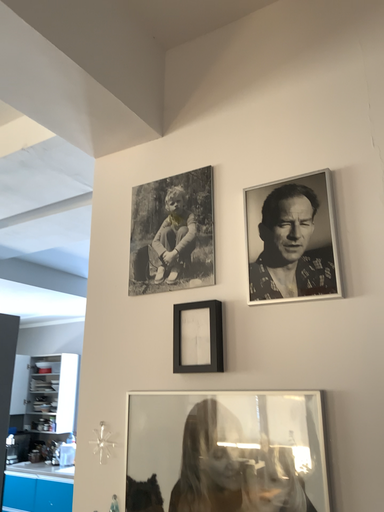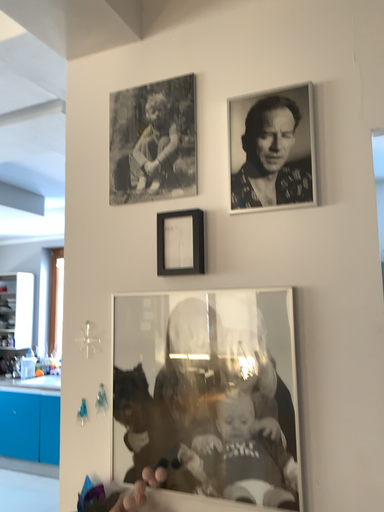
Question: Which way did the camera rotate in the video?

Choices:
 (A) rotated left
 (B) rotated right

Answer: (B)